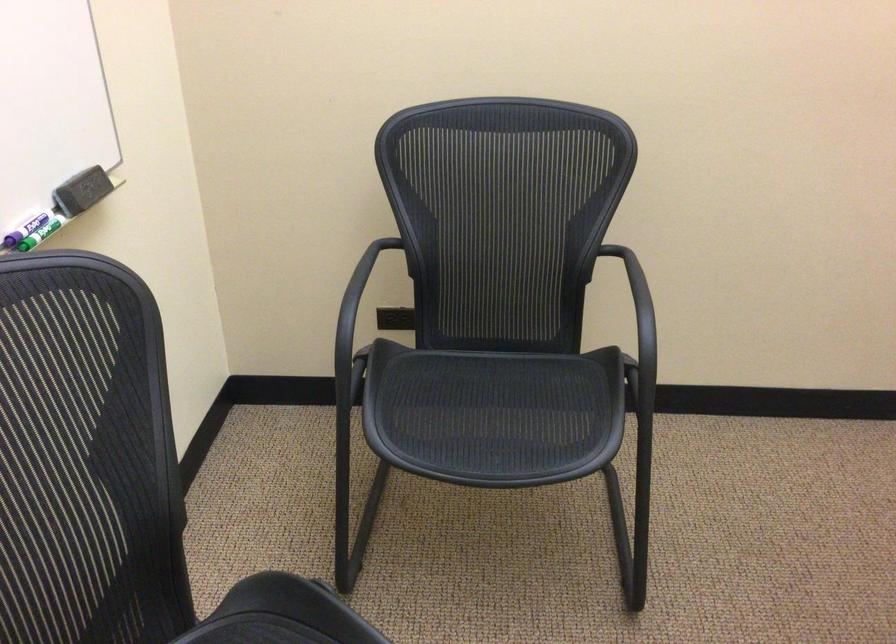
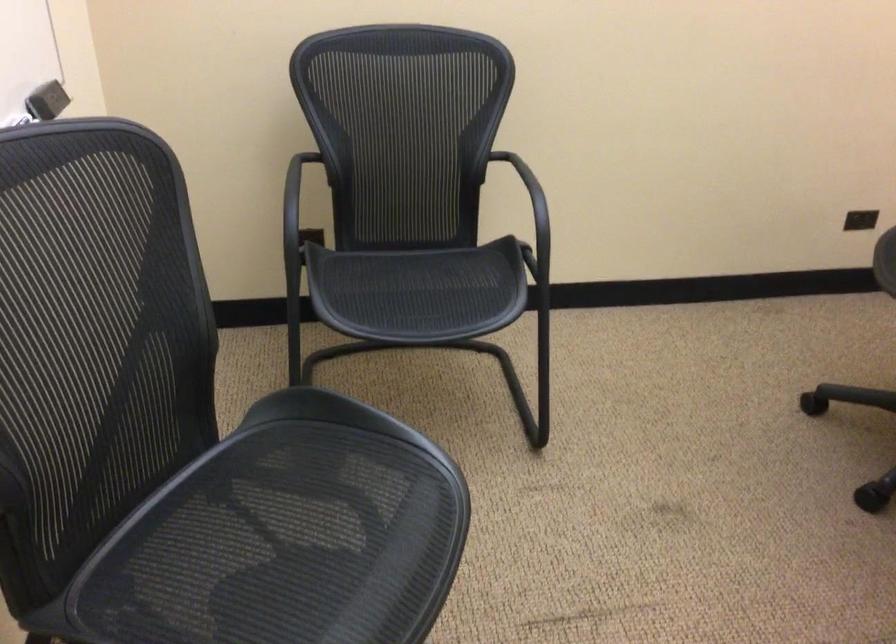
Where in the second image is the point corresponding to (88,169) from the first image?

(49, 84)